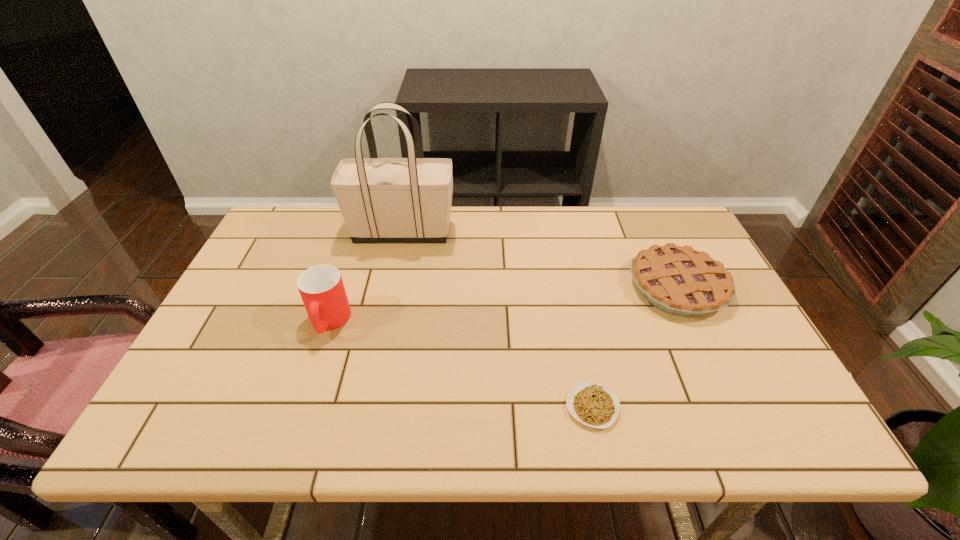
Identify the location of shopping bag. (382, 200).

Identify the location of the farthest object. (382, 200).

Where is `the third shortest object`? The height and width of the screenshot is (540, 960). the third shortest object is located at coordinates (321, 287).

At what (x,y) coordinates should I click in order to perform the action: click on the third tallest object. Please return your answer as a coordinate pair (x, y). This screenshot has width=960, height=540. Looking at the image, I should click on [681, 281].

This screenshot has height=540, width=960. In order to click on pie in this screenshot , I will do `click(681, 281)`.

At what (x,y) coordinates should I click in order to perform the action: click on the shortest object. Please return your answer as a coordinate pair (x, y). Looking at the image, I should click on (594, 405).

This screenshot has width=960, height=540. I want to click on the second object from right to left, so click(594, 405).

Identify the location of vacant space situated 0.360m with handles facing forward on the tallest object. (568, 231).

Identify the location of free space located on the side of the cup with the handle. The image size is (960, 540). pos(298,416).

Locate an element on the screen. vacant space located 0.350m on the left of the pie is located at coordinates (502, 287).